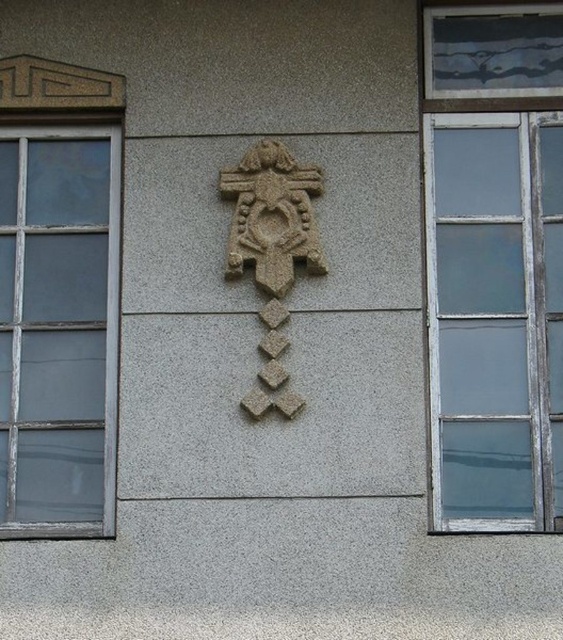
Which of these two, clear glass window at right or clear glass window at left, stands taller?

With more height is clear glass window at right.

Is clear glass window at right taller than clear glass window at left?

Yes.

You are a GUI agent. You are given a task and a screenshot of the screen. Output one action in this format:
    pyautogui.click(x=<x>, y=<y>)
    Task: Click on the clear glass window at right
    This screenshot has width=563, height=640.
    Given the screenshot: What is the action you would take?
    pyautogui.click(x=494, y=264)

Is clear glass window at left thinner than granite stone cross at center?

In fact, clear glass window at left might be wider than granite stone cross at center.

Where is `clear glass window at left`? The width and height of the screenshot is (563, 640). clear glass window at left is located at coordinates (59, 296).

Between point (30, 208) and point (249, 403), which one is positioned behind?

The point (30, 208) is behind.

Where is `clear glass window at left`? The height and width of the screenshot is (640, 563). clear glass window at left is located at coordinates (59, 296).

Can you confirm if clear glass window at right is positioned to the right of granite stone cross at center?

Yes, clear glass window at right is to the right of granite stone cross at center.

Is point (556, 481) closer to camera compared to point (265, 244)?

Yes, point (556, 481) is in front of point (265, 244).

What do you see at coordinates (494, 264) in the screenshot? I see `clear glass window at right` at bounding box center [494, 264].

The width and height of the screenshot is (563, 640). In order to click on clear glass window at right in this screenshot , I will do `click(494, 264)`.